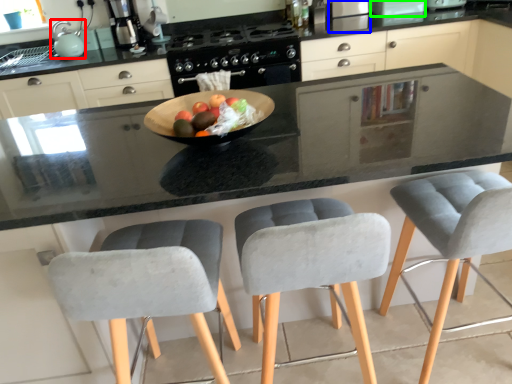
Question: Estimate the real-world distances between objects in this image. Which object is closer to appliance (highlighted by a red box), appliance (highlighted by a blue box) or appliance (highlighted by a green box)?

Choices:
 (A) appliance
 (B) appliance

Answer: (A)